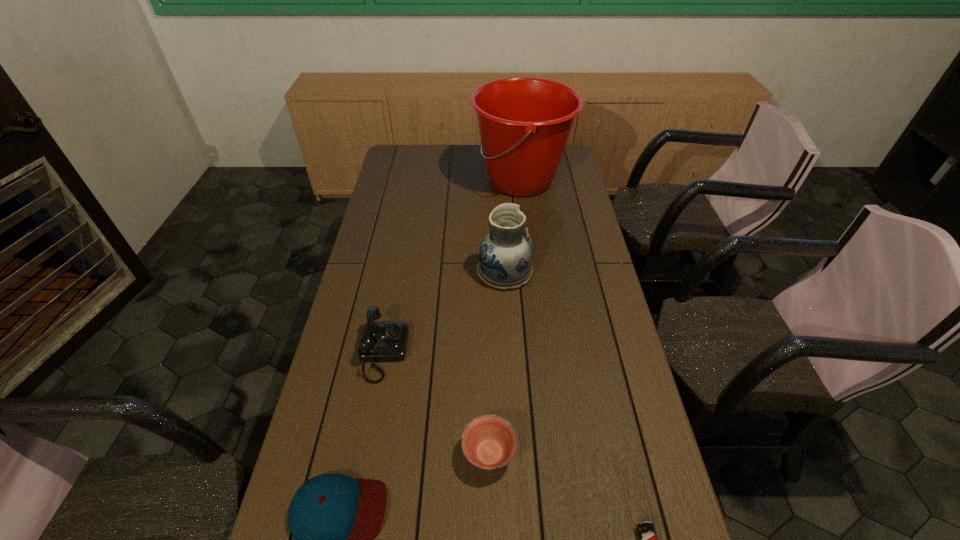
Identify the location of the tallest object. (524, 122).

Where is `the farthest object`? This screenshot has height=540, width=960. the farthest object is located at coordinates (524, 122).

This screenshot has width=960, height=540. What are the coordinates of `pottery` in the screenshot? It's located at (505, 257).

Locate an element on the screen. the second tallest object is located at coordinates (505, 257).

This screenshot has height=540, width=960. I want to click on the fourth nearest object, so click(381, 341).

I want to click on telephone, so click(x=381, y=341).

Where is `bowl`? The height and width of the screenshot is (540, 960). bowl is located at coordinates (489, 442).

Where is `free space located 0.070m with the handle attached to the rim of the bucket`? This screenshot has width=960, height=540. free space located 0.070m with the handle attached to the rim of the bucket is located at coordinates (456, 180).

You are a GUI agent. You are given a task and a screenshot of the screen. Output one action in this format:
    pyautogui.click(x=<x>, y=<y>)
    Task: Click on the vacant point located with the handle attached to the rim of the bucket
    The width and height of the screenshot is (960, 540).
    Given the screenshot: What is the action you would take?
    pyautogui.click(x=446, y=180)

Find the location of a particular element. This screenshot has height=540, width=960. vacant region located 0.110m with the handle attached to the rim of the bucket is located at coordinates (446, 180).